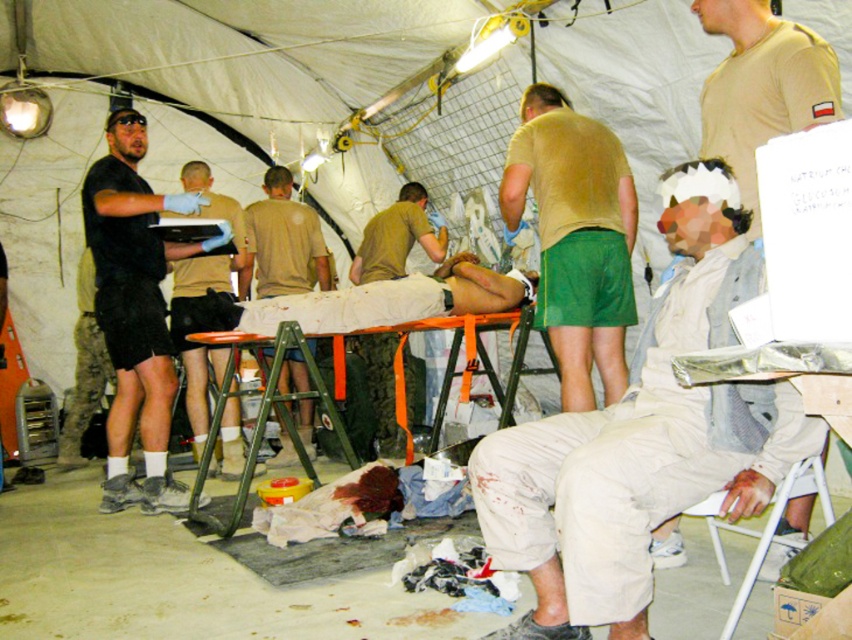
Question: Does white fabric tent at center appear on the left side of black matte t-shirt at left?

Choices:
 (A) no
 (B) yes

Answer: (B)

Question: Which object appears closest to the camera in this image?

Choices:
 (A) black matte t-shirt at left
 (B) light brown uniform at center
 (C) white fabric tent at center
 (D) white cotton shirt at center

Answer: (D)

Question: Does orange fabric stretcher at center have a lesser width compared to green matte uniform at center?

Choices:
 (A) yes
 (B) no

Answer: (B)

Question: From the image, what is the correct spatial relationship of white cotton shirt at center in relation to black matte shorts at center?

Choices:
 (A) above
 (B) below

Answer: (B)

Question: Among these objects, which one is nearest to the camera?

Choices:
 (A) black matte shorts at center
 (B) light brown t-shirt at center

Answer: (B)

Question: Estimate the real-world distances between objects in this image. Which object is closer to the black matte shorts at center?

Choices:
 (A) white fabric tent at center
 (B) green matte uniform at center
 (C) black matte t-shirt at left

Answer: (C)